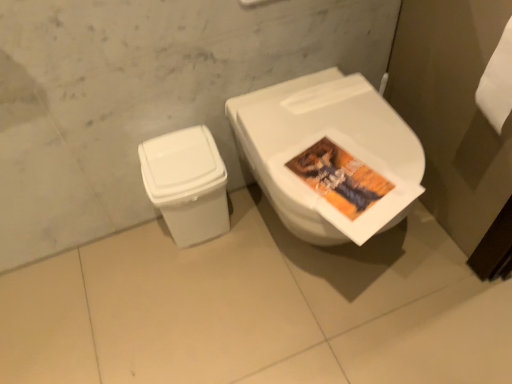
The width and height of the screenshot is (512, 384). I want to click on vacant space in between white glossy toilet at center and white plastic trash can at lower left, so click(x=237, y=271).